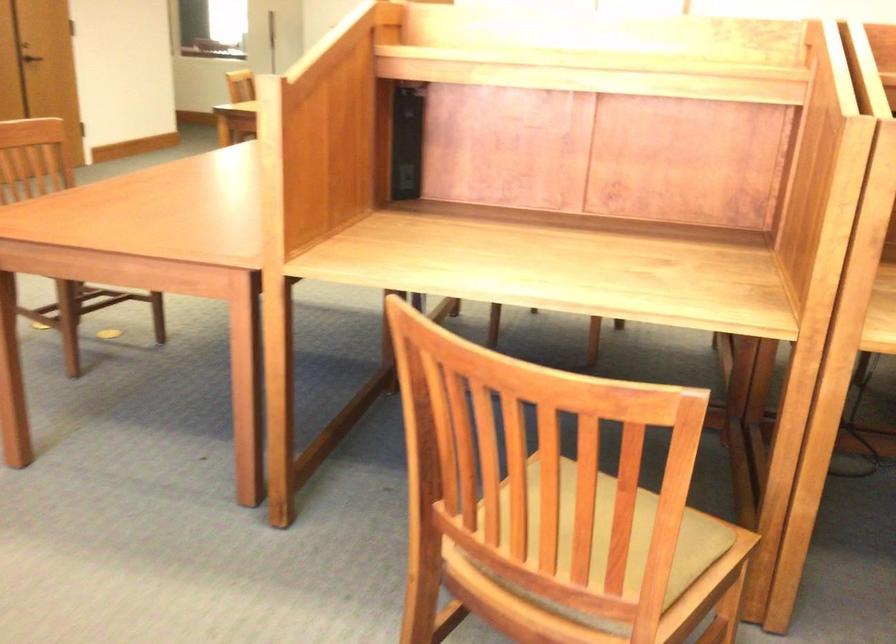
Image resolution: width=896 pixels, height=644 pixels. I want to click on metal door handle, so click(x=31, y=55).